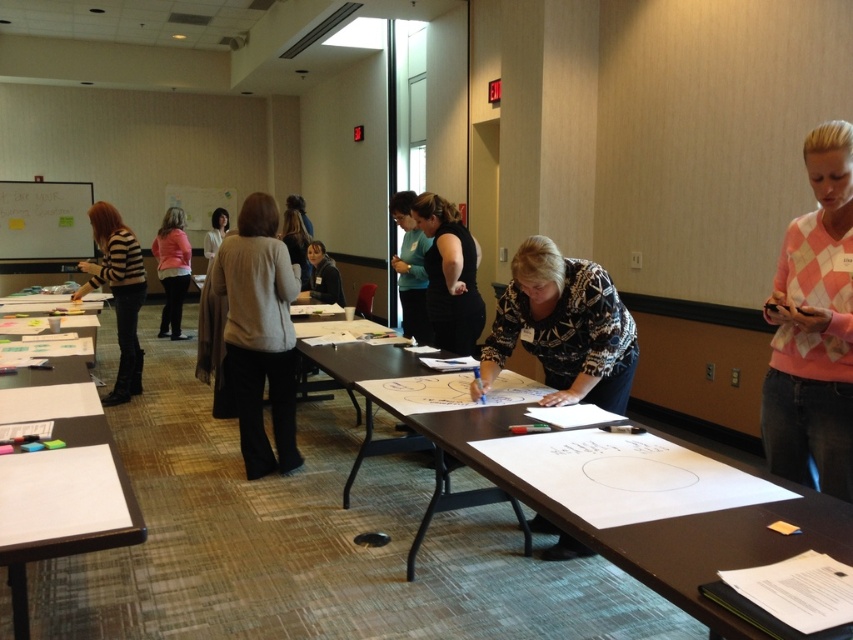
From the picture: You are standing at the entrance of the conference room. You need to locate the light gray sweater at center. Based on the coordinates given, where should you look to find it?

The light gray sweater at center is located at the 2D coordinates point (259, 333), so you should look towards the center of the image to find it.

You are organizing a presentation and need to decide where to place a projector. The black matte dress at center and the whiteboard at upper left are in the room. Which object is narrower so that the projector can be placed next to it without blocking the whiteboard?

The black matte dress at center has a lesser width compared to whiteboard at upper left, so placing the projector next to the black matte dress at center would leave enough space to avoid blocking the whiteboard.